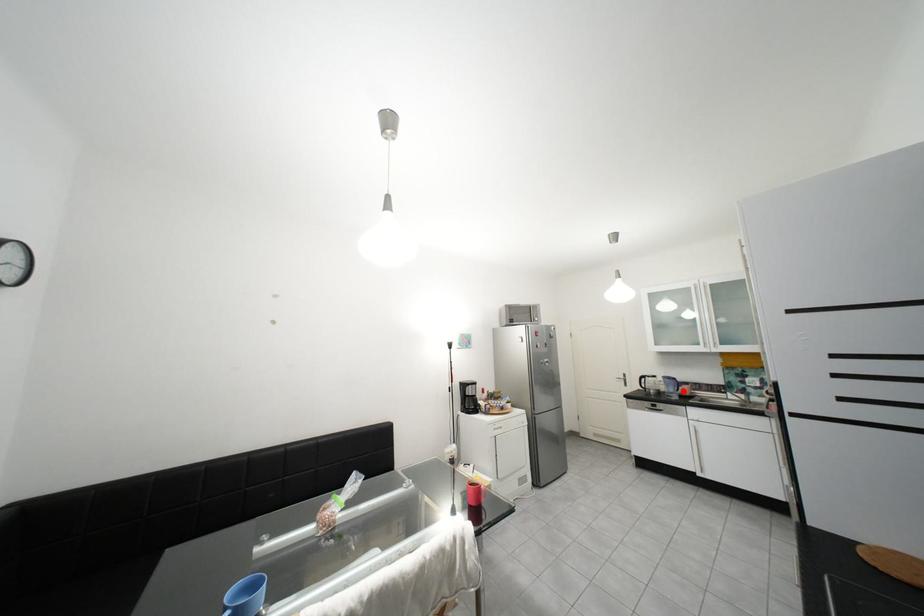
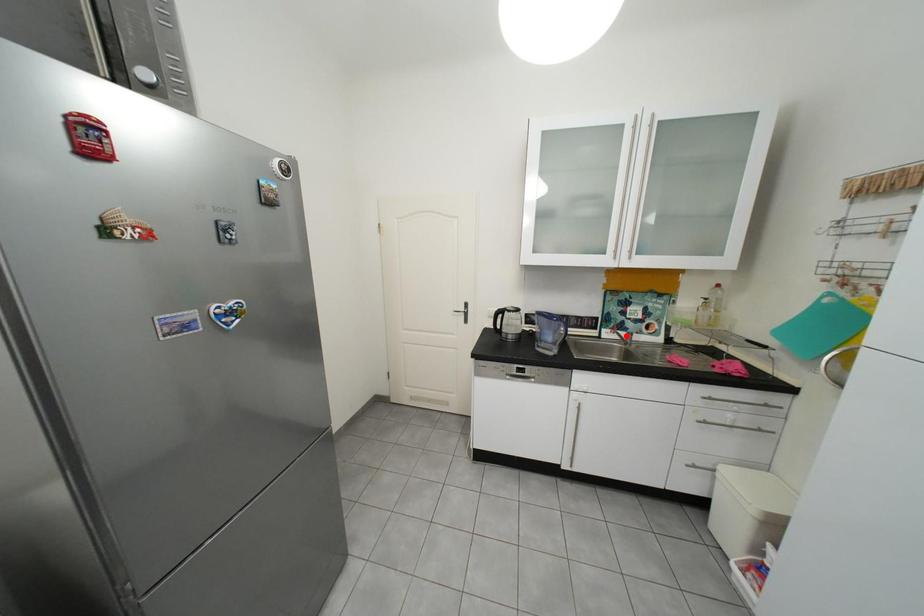
I am providing you with two images of the same scene from different viewpoints. A red point is marked on the first image and another point is marked on the second image. Is the red point in image1 aligned with the point shown in image2?

No